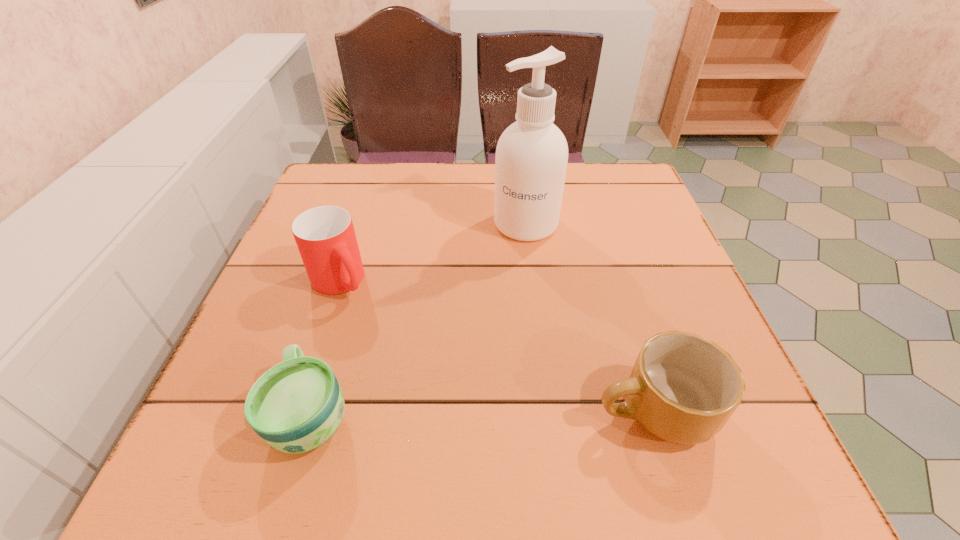
The image size is (960, 540). Identify the location of vacant area that lies between the shorter cup and the cleansing agent. (419, 319).

At what (x,y) coordinates should I click in order to perform the action: click on empty space that is in between the tallest object and the shorter cup. Please return your answer as a coordinate pair (x, y). Looking at the image, I should click on (419, 319).

The width and height of the screenshot is (960, 540). Identify the location of blank region between the second farthest object and the mug. (496, 345).

Find the location of a particular element. Image resolution: width=960 pixels, height=540 pixels. free spot between the tallest object and the mug is located at coordinates (589, 317).

This screenshot has height=540, width=960. I want to click on vacant region between the farther cup and the nearer cup, so click(x=325, y=347).

You are a GUI agent. You are given a task and a screenshot of the screen. Output one action in this format:
    pyautogui.click(x=<x>, y=<y>)
    Task: Click on the free spot between the shorter cup and the tallest object
    This screenshot has width=960, height=540.
    Given the screenshot: What is the action you would take?
    pyautogui.click(x=419, y=319)

At what (x,y) coordinates should I click in order to perform the action: click on vacant area that lies between the mug and the taller cup. Please return your answer as a coordinate pair (x, y). The width and height of the screenshot is (960, 540). Looking at the image, I should click on (496, 345).

This screenshot has width=960, height=540. Identify the location of free spot between the tallest object and the mug. (589, 317).

Locate an element on the screen. This screenshot has width=960, height=540. unoccupied area between the nearer cup and the mug is located at coordinates (482, 412).

Identify which object is the nearest to the nearer cup. Please provide its 2D coordinates. Your answer should be formatted as a tuple, i.e. [(x, y)], where the tuple contains the x and y coordinates of a point satisfying the conditions above.

[(325, 236)]